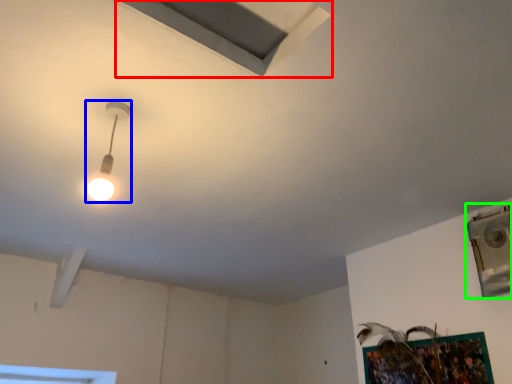
Question: Which object is positioned closest to exhaust hood (highlighted by a red box)? Select from lamp (highlighted by a blue box) and window (highlighted by a green box).

Choices:
 (A) lamp
 (B) window

Answer: (A)